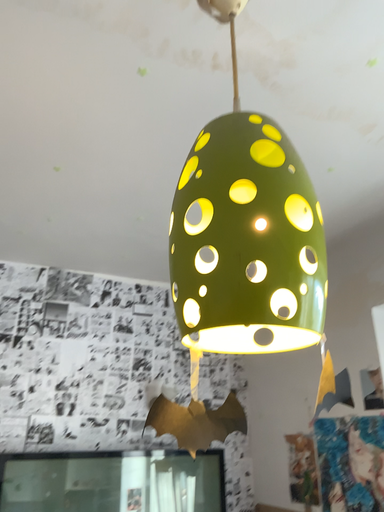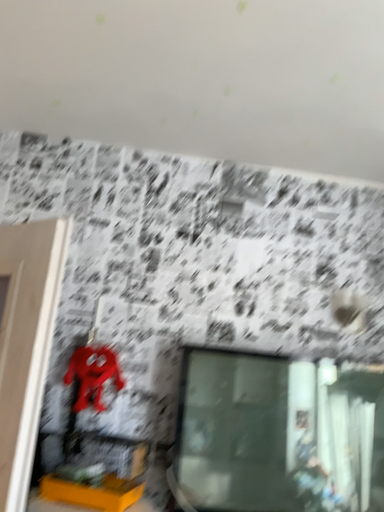
Question: Which way did the camera rotate in the video?

Choices:
 (A) rotated upward
 (B) rotated downward

Answer: (B)